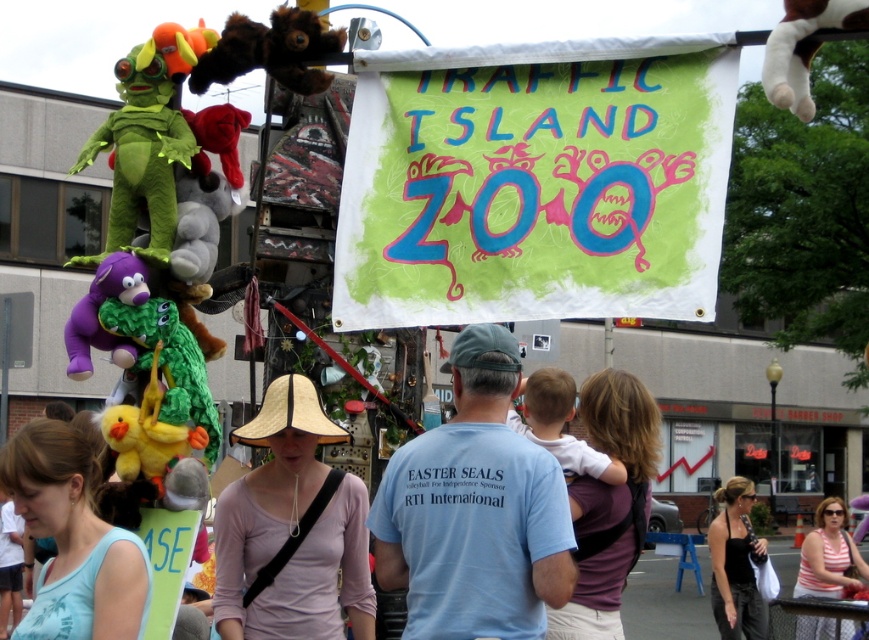
Question: Which object appears closest to the camera in this image?

Choices:
 (A) pink fabric hat at center
 (B) striped cotton tank top at center
 (C) green matte plush toy at left

Answer: (C)

Question: In this image, where is green matte plush toy at left located relative to yellow plush duck at center?

Choices:
 (A) below
 (B) above

Answer: (B)

Question: Is pink fabric hat at center smaller than brown furry stuffed bear at upper center?

Choices:
 (A) yes
 (B) no

Answer: (B)

Question: Can you confirm if light blue cotton t-shirt at center is wider than yellow plush duck at center?

Choices:
 (A) no
 (B) yes

Answer: (B)

Question: Which object is farther from the camera taking this photo?

Choices:
 (A) black fabric dress at lower right
 (B) striped cotton tank top at center

Answer: (A)

Question: Which of these objects is positioned closest to the white plush monkey at upper right?

Choices:
 (A) yellow plush duck at center
 (B) green matte plush toy at left
 (C) light blue cotton t-shirt at center
 (D) brown furry stuffed bear at upper center

Answer: (D)